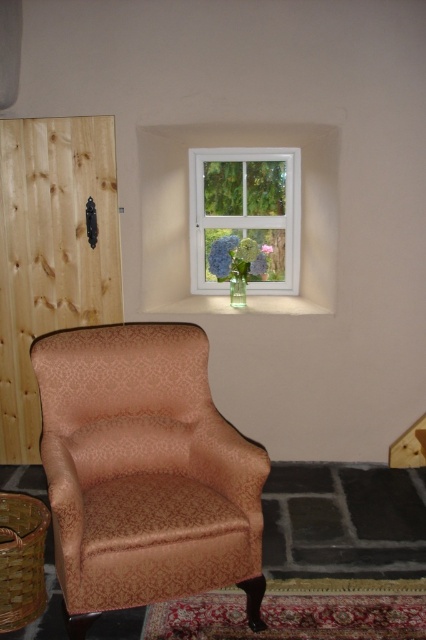
Question: Is clear glass window at upper center bigger than hydrangea bouquet at center?

Choices:
 (A) yes
 (B) no

Answer: (A)

Question: Based on their relative distances, which object is nearer to the purple matte flower at center?

Choices:
 (A) gold-patterned fabric armchair at center
 (B) transparent glass vase at center
 (C) green matte flower at window
 (D) hydrangea bouquet at center

Answer: (D)

Question: Which point is farther to the camera?

Choices:
 (A) clear glass window at upper center
 (B) transparent glass vase at center
 (C) hydrangea bouquet at center

Answer: (A)

Question: From the image, what is the correct spatial relationship of purple matte flower at center in relation to transparent glass vase at center?

Choices:
 (A) left
 (B) right

Answer: (A)

Question: Does hydrangea bouquet at center have a greater width compared to purple matte flower at center?

Choices:
 (A) no
 (B) yes

Answer: (B)

Question: Which of these objects is positioned farthest from the clear glass window at upper center?

Choices:
 (A) green matte flower at window
 (B) gold-patterned fabric armchair at center
 (C) purple matte flower at center

Answer: (B)